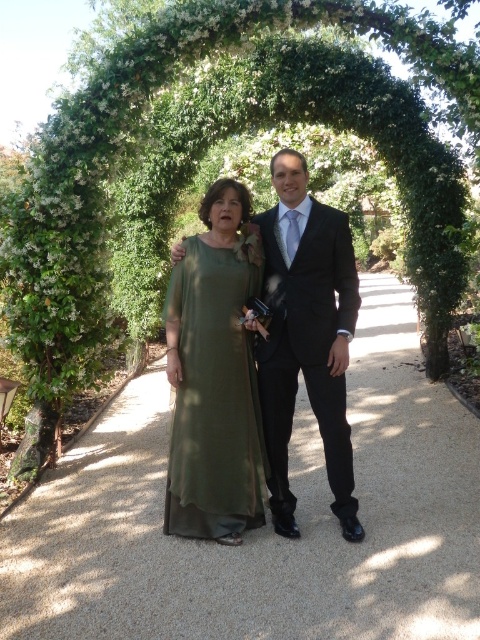
Question: Among these objects, which one is nearest to the camera?

Choices:
 (A) olive green satin dress at center
 (B) matte green dress at center
 (C) black satin suit at center

Answer: (B)

Question: In this image, where is matte green dress at center located relative to olive green satin dress at center?

Choices:
 (A) left
 (B) right

Answer: (B)

Question: Which object is positioned closest to the black satin suit at center?

Choices:
 (A) olive green satin dress at center
 (B) matte green dress at center
 (C) gravel pathway at center

Answer: (B)

Question: In this image, where is matte green dress at center located relative to olive green satin dress at center?

Choices:
 (A) left
 (B) right

Answer: (B)

Question: Where is matte green dress at center located in relation to black satin suit at center in the image?

Choices:
 (A) below
 (B) above

Answer: (B)

Question: Which object is the closest to the black satin suit at center?

Choices:
 (A) matte green dress at center
 (B) gravel pathway at center
 (C) olive green satin dress at center

Answer: (A)